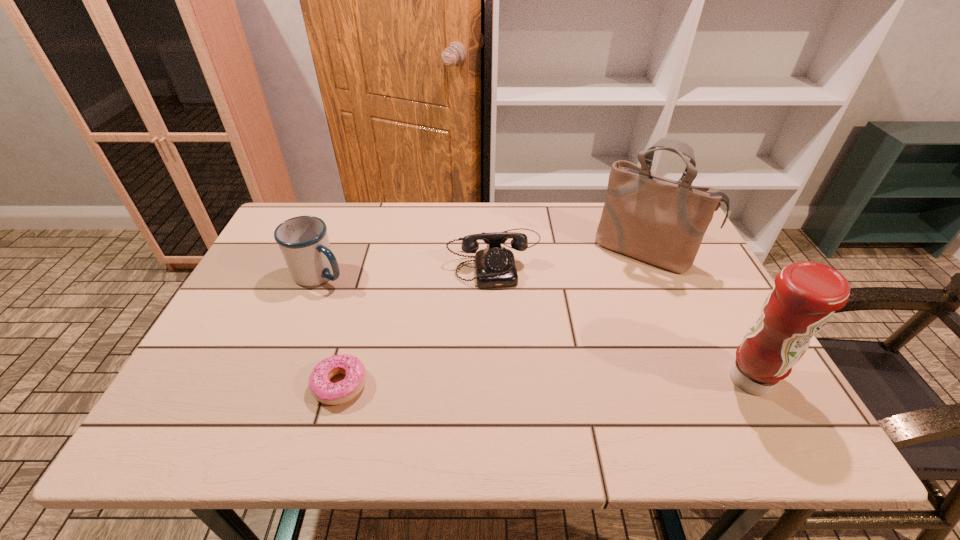
Where is `free location located 0.390m on the front-facing side of the tallest object`? Image resolution: width=960 pixels, height=540 pixels. free location located 0.390m on the front-facing side of the tallest object is located at coordinates (574, 369).

Image resolution: width=960 pixels, height=540 pixels. I want to click on free space located on the front-facing side of the tallest object, so click(x=606, y=311).

Find the location of `blank space located 0.290m on the front-facing side of the tallest object`. blank space located 0.290m on the front-facing side of the tallest object is located at coordinates (590, 340).

This screenshot has height=540, width=960. What are the coordinates of `free space located 0.290m on the front-facing side of the fourth tallest object` in the screenshot? It's located at [514, 379].

Image resolution: width=960 pixels, height=540 pixels. Identify the location of vacant area located 0.310m on the front-facing side of the fourth tallest object. (515, 387).

Where is `vacant space situated on the front-facing side of the fourth tallest object`? The width and height of the screenshot is (960, 540). vacant space situated on the front-facing side of the fourth tallest object is located at coordinates (516, 399).

This screenshot has height=540, width=960. What are the coordinates of `vacant space located on the handle side of the leftmost object` in the screenshot? It's located at (439, 328).

Find the location of `blank space located 0.350m on the handle side of the leftmost object`. blank space located 0.350m on the handle side of the leftmost object is located at coordinates click(448, 333).

Find the location of a particular element. This screenshot has width=960, height=540. free space located 0.310m on the handle side of the leftmost object is located at coordinates (435, 327).

The height and width of the screenshot is (540, 960). I want to click on shoulder bag present at the far edge, so click(x=657, y=220).